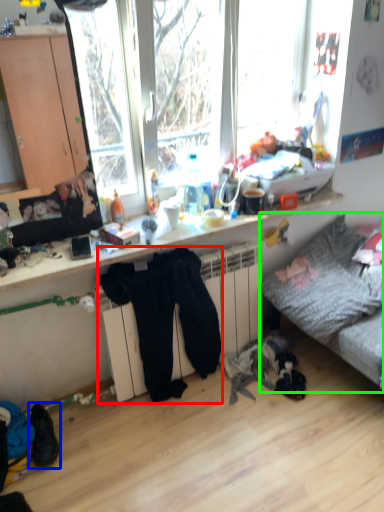
Question: Which object is positioned closest to clothing (highlighted by a red box)? Select from footwear (highlighted by a blue box) and studio couch (highlighted by a green box).

Choices:
 (A) footwear
 (B) studio couch

Answer: (B)